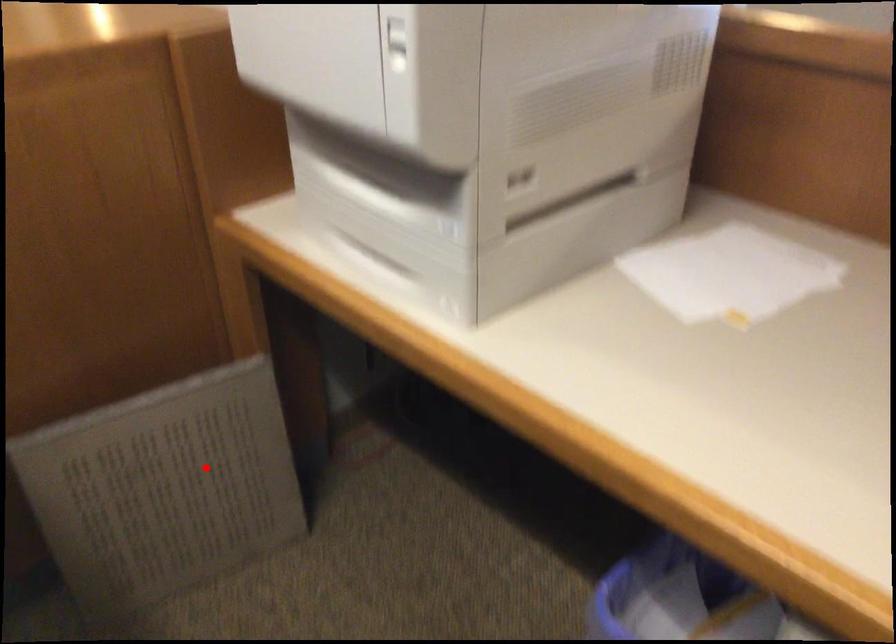
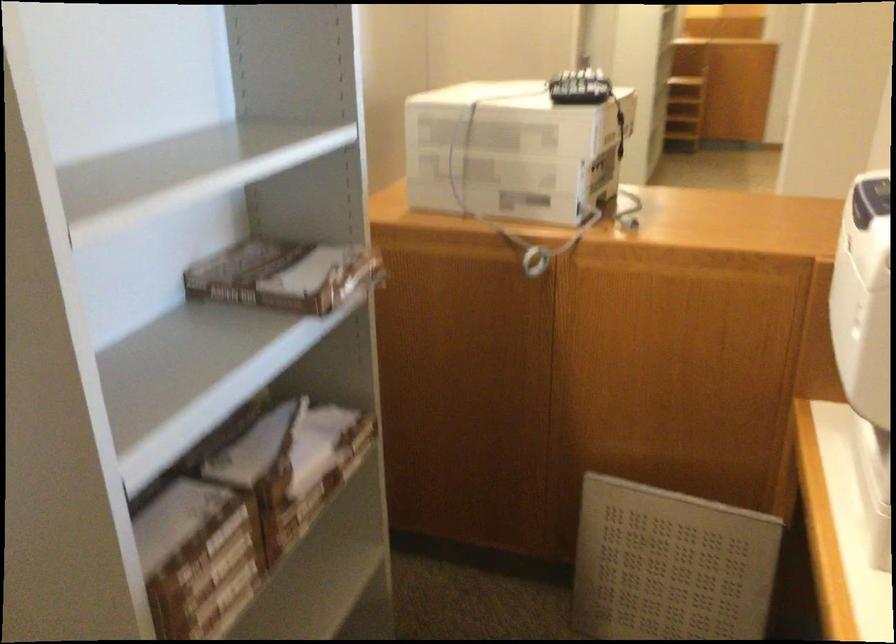
In the second image, find the point that corresponds to the highlighted location in the first image.

(669, 565)